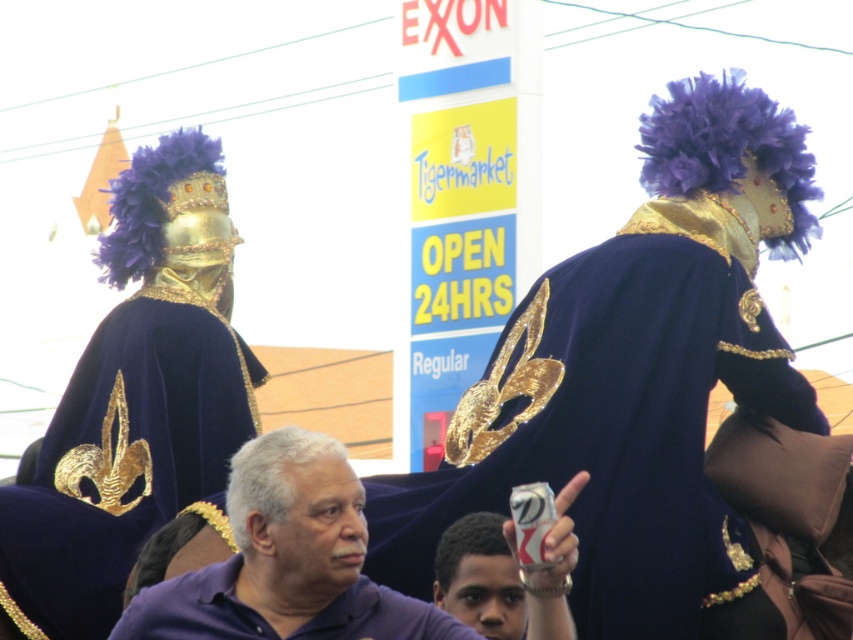
In the scene shown: You are a photographer at the event and want to capture both the velvet dark blue robe at center and the purple velvet robe at center in a single frame. Based on their positions, which robe should you focus on first to ensure both are in the frame?

The velvet dark blue robe at center is located above the purple velvet robe at center, so you should focus on the purple velvet robe at center first to ensure both are in the frame.